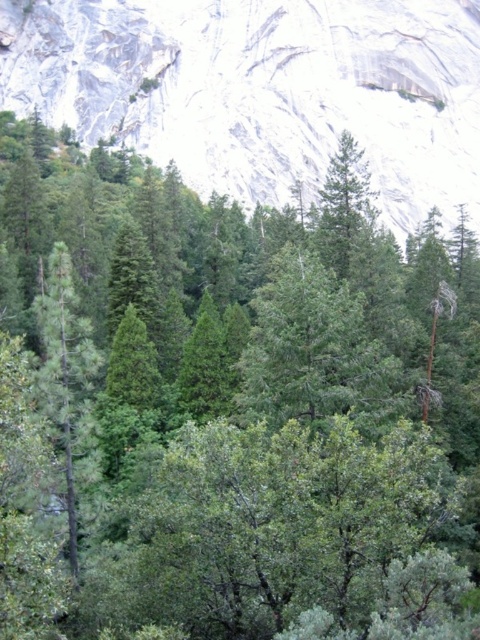
You are a hiker who wants to reach the white rock at upper center. Based on the coordinates provided, what direction should you head from your current position at the forest floor?

The white rock at upper center is located at coordinates point (264, 90), so you should head north from your current position at the forest floor to reach it.

You are standing in a forest and want to take a photo of the point at coordinates point (39, 84). If your camera has a maximum range of 150 meters, will you be able to capture that point in your photo?

The distance between point (39, 84) and the camera is 150.65 meters, which exceeds the camera maximum range of 150 meters. Therefore, you won not be able to capture that point in your photo.

You are a hiker navigating through the forest and want to reach the mountain peak. You see the green matte tree at left and the white rock at upper center. Which object is closer to you as you look towards the mountain?

The white rock at upper center is closer to you because the green matte tree at left is behind it.